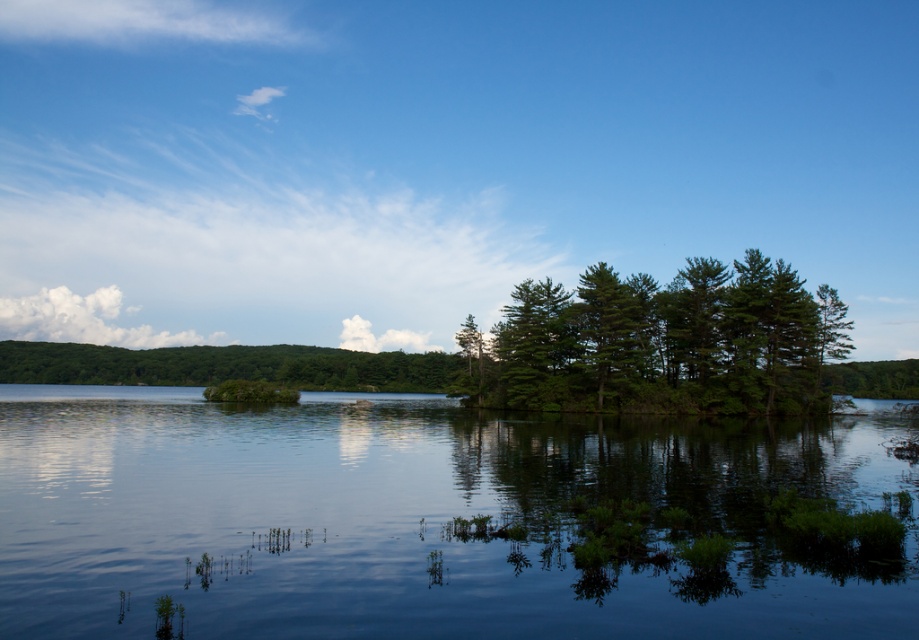
Between point (563, 538) and point (103, 346), which one is positioned behind?

Positioned behind is point (103, 346).

Does point (539, 452) lie in front of point (284, 353)?

Yes, point (539, 452) is closer to viewer.

Based on the photo, who is more forward, (x=841, y=433) or (x=418, y=385)?

Point (x=841, y=433) is more forward.

Identify the location of transparent blue water at center. The image size is (919, 640). (416, 518).

Image resolution: width=919 pixels, height=640 pixels. In order to click on transparent blue water at center in this screenshot , I will do `click(416, 518)`.

Who is lower down, transparent blue water at center or green matte trees at center?

Positioned lower is transparent blue water at center.

This screenshot has width=919, height=640. What do you see at coordinates (416, 518) in the screenshot? I see `transparent blue water at center` at bounding box center [416, 518].

I want to click on transparent blue water at center, so click(416, 518).

Is green matte trees at center wider than green matte tree at center?

In fact, green matte trees at center might be narrower than green matte tree at center.

From the picture: Is green matte trees at center taller than green matte tree at center?

Indeed, green matte trees at center has a greater height compared to green matte tree at center.

Where is `green matte trees at center`? The height and width of the screenshot is (640, 919). green matte trees at center is located at coordinates pyautogui.click(x=664, y=342).